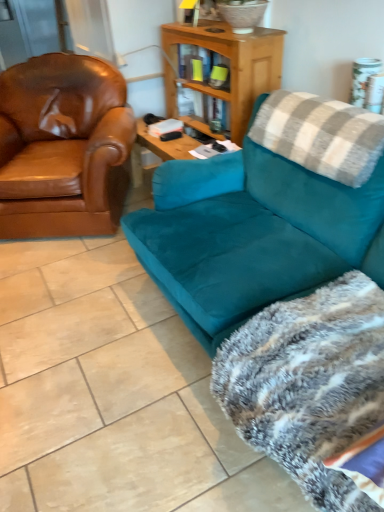
Question: Would you say brown leather armchair at left is a long distance from fluffy gray blanket at lower right?

Choices:
 (A) no
 (B) yes

Answer: (B)

Question: Does brown leather armchair at left come in front of fluffy gray blanket at lower right?

Choices:
 (A) yes
 (B) no

Answer: (B)

Question: Does brown leather armchair at left have a greater width compared to fluffy gray blanket at lower right?

Choices:
 (A) no
 (B) yes

Answer: (B)

Question: From a real-world perspective, is brown leather armchair at left over fluffy gray blanket at lower right?

Choices:
 (A) yes
 (B) no

Answer: (A)

Question: Is brown leather armchair at left to the right of fluffy gray blanket at lower right from the viewer's perspective?

Choices:
 (A) yes
 (B) no

Answer: (B)

Question: Considering the relative sizes of brown leather armchair at left and fluffy gray blanket at lower right in the image provided, is brown leather armchair at left taller than fluffy gray blanket at lower right?

Choices:
 (A) no
 (B) yes

Answer: (B)

Question: Would you say teal suede couch at right is a long distance from gray plaid pillow at upper right?

Choices:
 (A) no
 (B) yes

Answer: (A)

Question: Is teal suede couch at right oriented towards gray plaid pillow at upper right?

Choices:
 (A) no
 (B) yes

Answer: (A)

Question: Is teal suede couch at right at the left side of gray plaid pillow at upper right?

Choices:
 (A) no
 (B) yes

Answer: (B)

Question: Is gray plaid pillow at upper right a part of teal suede couch at right?

Choices:
 (A) yes
 (B) no

Answer: (A)

Question: Is teal suede couch at right smaller than gray plaid pillow at upper right?

Choices:
 (A) no
 (B) yes

Answer: (A)

Question: From the image's perspective, is teal suede couch at right beneath gray plaid pillow at upper right?

Choices:
 (A) yes
 (B) no

Answer: (A)

Question: Can we say fluffy gray blanket at lower right lies outside gray plaid pillow at upper right?

Choices:
 (A) no
 (B) yes

Answer: (B)